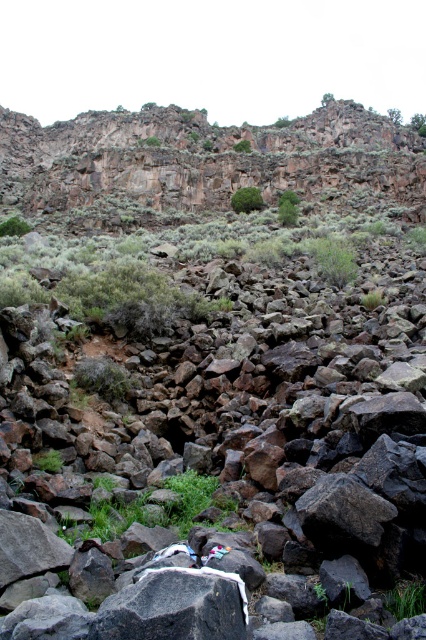
Is rugged rock cliff at upper center to the left of green mossy rock at upper center from the viewer's perspective?

Indeed, rugged rock cliff at upper center is positioned on the left side of green mossy rock at upper center.

Between rugged rock cliff at upper center and green mossy rock at upper center, which one is positioned lower?

green mossy rock at upper center is lower down.

Image resolution: width=426 pixels, height=640 pixels. Identify the location of rugged rock cliff at upper center. (209, 157).

From the picture: Can you confirm if rugged rock cliff at upper center is positioned below green leafy shrub at lower left?

No.

Which is more to the left, rugged rock cliff at upper center or green leafy shrub at lower left?

From the viewer's perspective, green leafy shrub at lower left appears more on the left side.

Does point (368, 170) lie in front of point (23, 221)?

No, it is behind (23, 221).

You are a GUI agent. You are given a task and a screenshot of the screen. Output one action in this format:
    pyautogui.click(x=<x>, y=<y>)
    Task: Click on the rugged rock cliff at upper center
    The height and width of the screenshot is (640, 426).
    Given the screenshot: What is the action you would take?
    pyautogui.click(x=209, y=157)

Between point (11, 220) and point (238, 145), which one is positioned in front?

Point (11, 220) is in front.

Who is more distant from viewer, (0, 228) or (244, 144)?

The point (244, 144) is more distant.

You are a GUI agent. You are given a task and a screenshot of the screen. Output one action in this format:
    pyautogui.click(x=<x>, y=<y>)
    Task: Click on the green leafy shrub at lower left
    
    Given the screenshot: What is the action you would take?
    pyautogui.click(x=14, y=227)